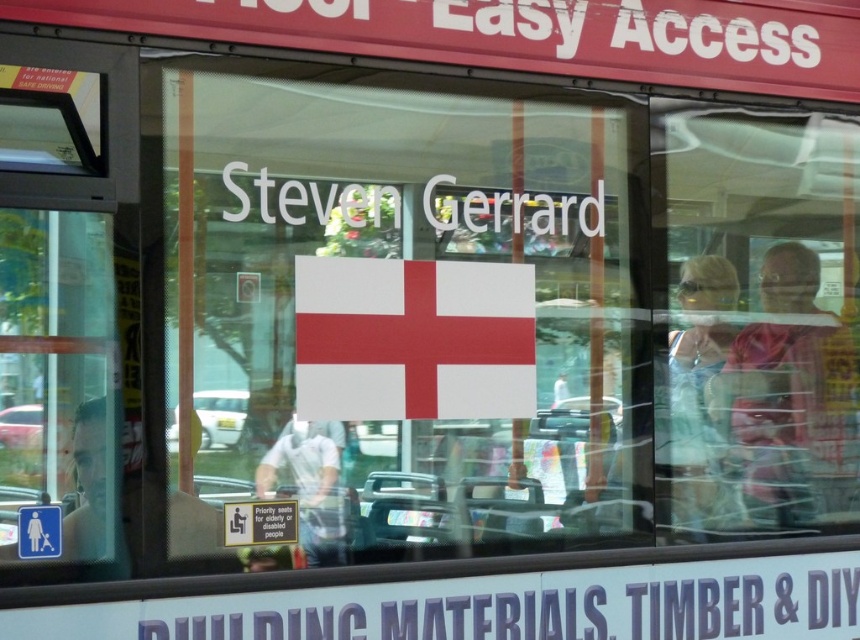
Question: Is white paper at center bigger than white matte flag at center?

Choices:
 (A) no
 (B) yes

Answer: (B)

Question: Among these objects, which one is farthest from the camera?

Choices:
 (A) white matte flag at center
 (B) white paper at center

Answer: (A)

Question: Does white paper at center have a larger size compared to white matte flag at center?

Choices:
 (A) no
 (B) yes

Answer: (B)

Question: Among these points, which one is farthest from the camera?

Choices:
 (A) (493, 396)
 (B) (366, 266)

Answer: (A)

Question: Is white paper at center to the left of white matte flag at center from the viewer's perspective?

Choices:
 (A) yes
 (B) no

Answer: (B)